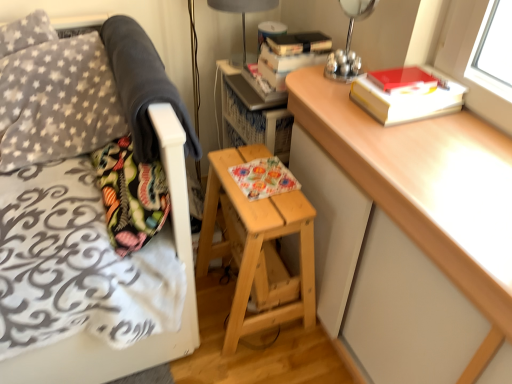
Question: Does fluffy fabric pillow at left appear on the left side of light brown wooden stool at center?

Choices:
 (A) yes
 (B) no

Answer: (A)

Question: Is light brown wooden stool at center at the back of fluffy fabric pillow at left?

Choices:
 (A) no
 (B) yes

Answer: (A)

Question: Does fluffy fabric pillow at left touch light brown wooden stool at center?

Choices:
 (A) yes
 (B) no

Answer: (B)

Question: From the image's perspective, is fluffy fabric pillow at left located beneath light brown wooden stool at center?

Choices:
 (A) yes
 (B) no

Answer: (B)

Question: Can you confirm if fluffy fabric pillow at left is bigger than light brown wooden stool at center?

Choices:
 (A) yes
 (B) no

Answer: (B)

Question: From the image's perspective, is floral paper book at center, the 1th book from the bottom, above or below light brown wooden stool at center?

Choices:
 (A) above
 (B) below

Answer: (A)

Question: Is floral paper book at center, the 1th book from the bottom, in front of or behind light brown wooden stool at center in the image?

Choices:
 (A) front
 (B) behind

Answer: (B)

Question: Based on their sizes in the image, would you say floral paper book at center, placed as the 2th book when sorted from top to bottom, is bigger or smaller than light brown wooden stool at center?

Choices:
 (A) small
 (B) big

Answer: (A)

Question: Considering the positions of floral paper book at center, placed as the 2th book when sorted from top to bottom, and light brown wooden stool at center in the image, is floral paper book at center, placed as the 2th book when sorted from top to bottom, wider or thinner than light brown wooden stool at center?

Choices:
 (A) thin
 (B) wide

Answer: (A)

Question: Is fluffy fabric pillow at left bigger or smaller than hardcover book at upper right, the 1th paperback book positioned from the bottom?

Choices:
 (A) big
 (B) small

Answer: (A)

Question: Based on their positions, is fluffy fabric pillow at left located to the left or right of hardcover book at upper right, the 1th paperback book positioned from the bottom?

Choices:
 (A) left
 (B) right

Answer: (A)

Question: Is point coord(117,195) positioned closer to the camera than point coord(423,66)?

Choices:
 (A) closer
 (B) farther

Answer: (A)

Question: From a real-world perspective, is fluffy fabric pillow at left physically located above or below hardcover book at upper right, the second paperback book when ordered from top to bottom?

Choices:
 (A) below
 (B) above

Answer: (A)

Question: Looking at their shapes, would you say light brown wooden stool at center is wider or thinner than matte red paperback book at upper right, which is counted as the first paperback book, starting from the top?

Choices:
 (A) wide
 (B) thin

Answer: (A)

Question: From a real-world perspective, is light brown wooden stool at center above or below matte red paperback book at upper right, which appears as the second paperback book when ordered from the bottom?

Choices:
 (A) above
 (B) below

Answer: (B)